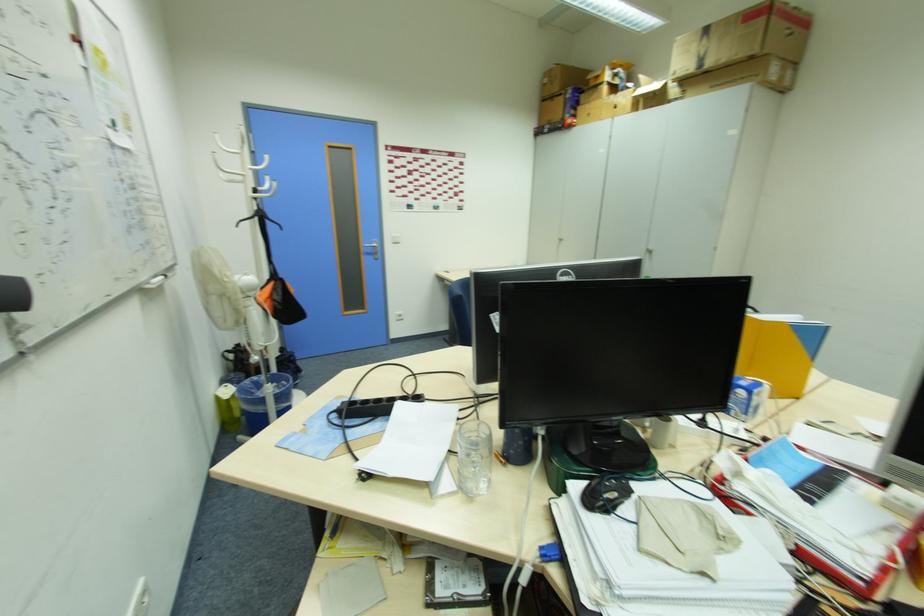
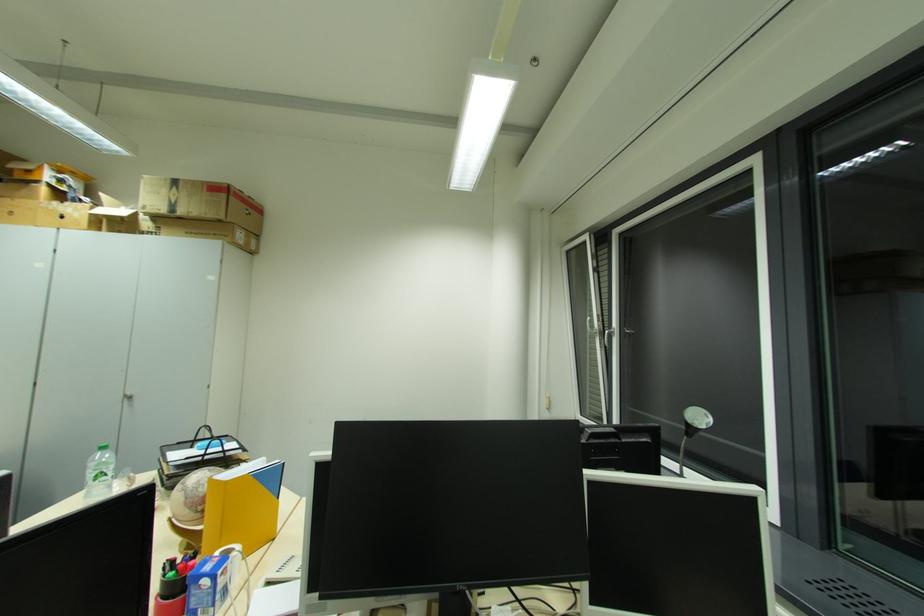
The point at (772, 384) is marked in the first image. Where is the corresponding point in the second image?

(242, 548)